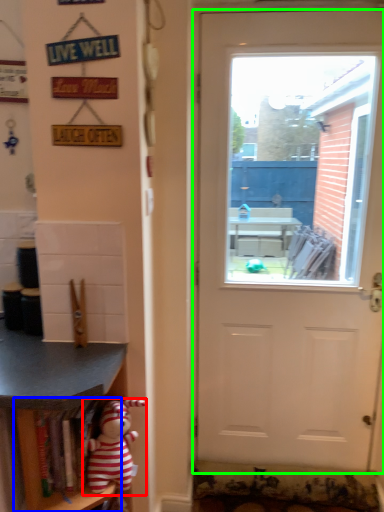
Question: Which is farther away from toy (highlighted by a red box)? shelf (highlighted by a blue box) or door (highlighted by a green box)?

Choices:
 (A) shelf
 (B) door

Answer: (B)